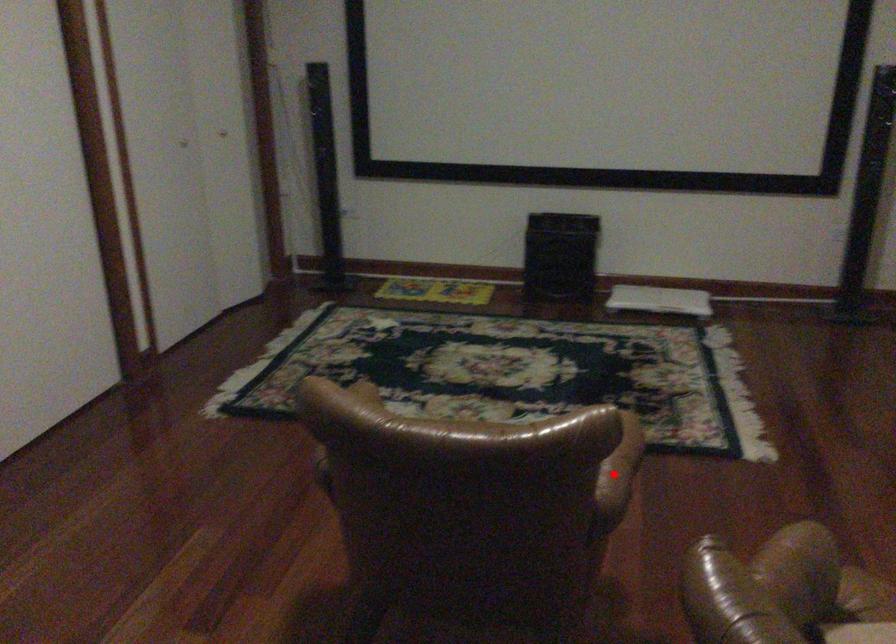
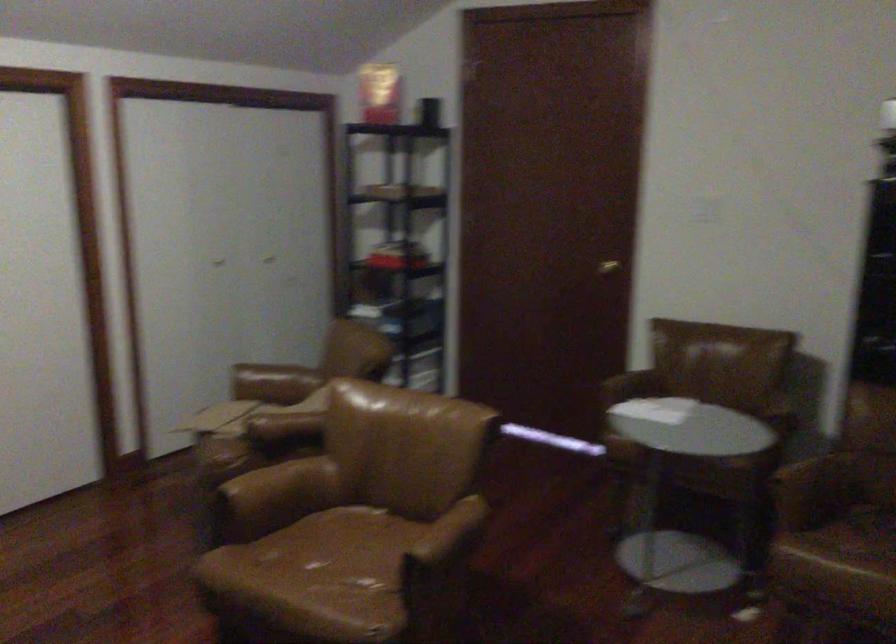
Question: I am providing you with two images of the same scene from different viewpoints. In image1, a red point is highlighted. Considering the same 3D point in image2, which of the following is correct?

Choices:
 (A) It is closer
 (B) It is farther

Answer: (B)